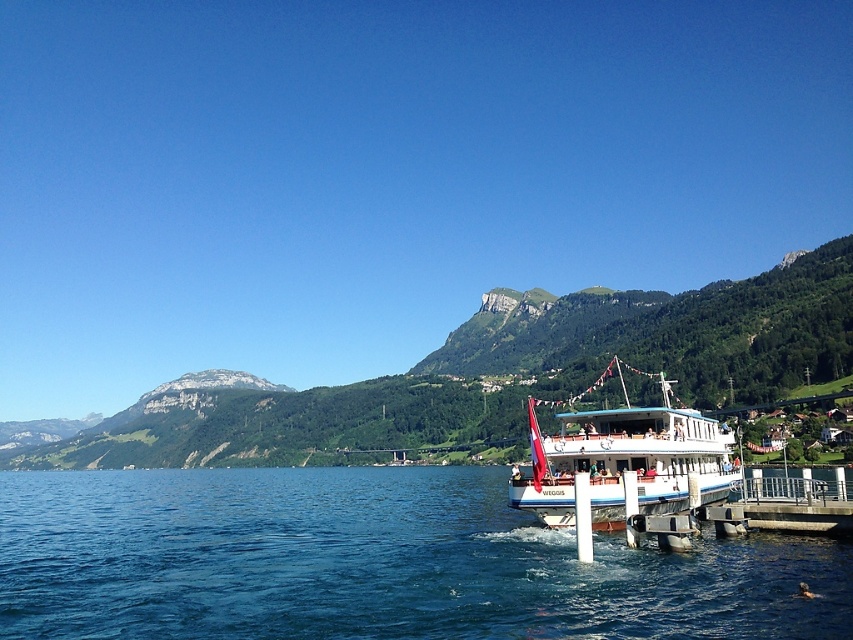
Looking at this image, you are standing on the lakeside and want to take a photo of the green grassy mountain at center and the white glossy boat at center. Which object will appear closer to you in the photo?

The green grassy mountain at center will appear closer to you in the photo because it is positioned closer to the viewer compared to the white glossy boat at center.